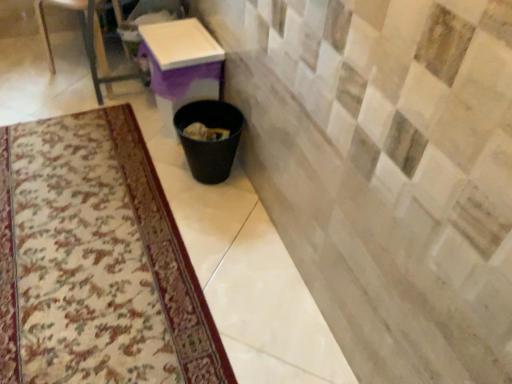
The image size is (512, 384). Identify the location of vacant area situated below carpeted mat at lower left (from a real-world perspective). click(x=95, y=266).